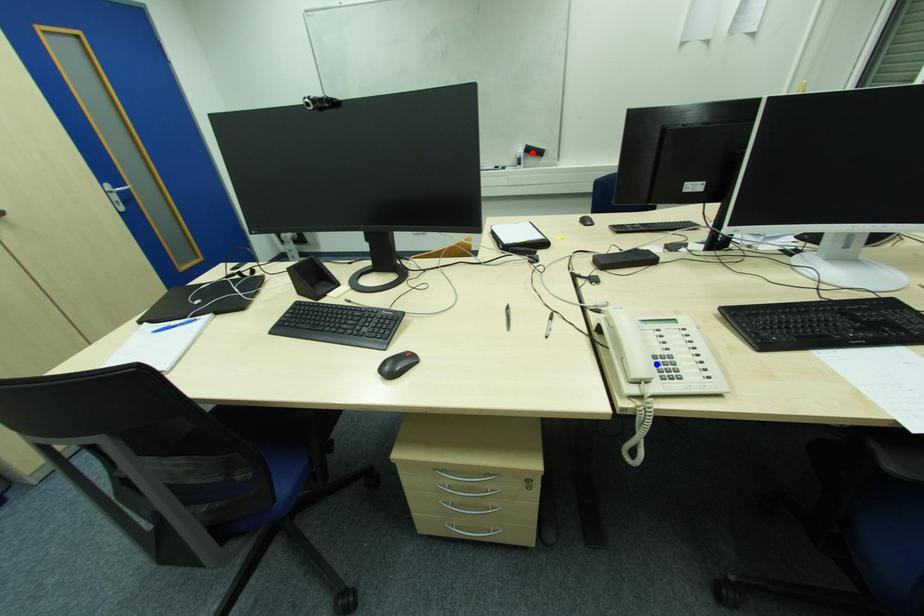
Question: In the image, two points are highlighted. Which point is nearer to the camera? Reply with the corresponding letter.

Choices:
 (A) blue point
 (B) red point

Answer: (A)